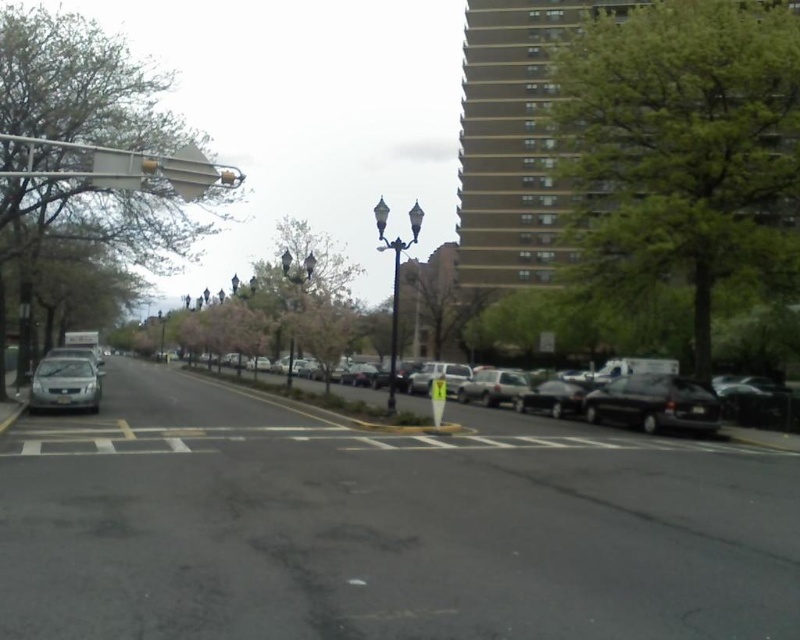
You are a city planner analyzing this street scene. You need to determine which tree has a larger canopy to decide where to place a new bench. Which tree between the green leafy tree at upper right and the green leafy tree at left has a larger canopy?

The green leafy tree at left has a larger canopy than the green leafy tree at upper right.

Based on the photo, you are a drone operator who needs to capture aerial footage of the green leafy tree at upper right. The drone has a maximum flight range of 25 meters. Based on the scene, can the drone safely reach the tree without exceeding its range?

The green leafy tree at upper right is 23.52 meters away from camera, so yes, the drone can safely reach it as the distance is within the 25 meters maximum range.